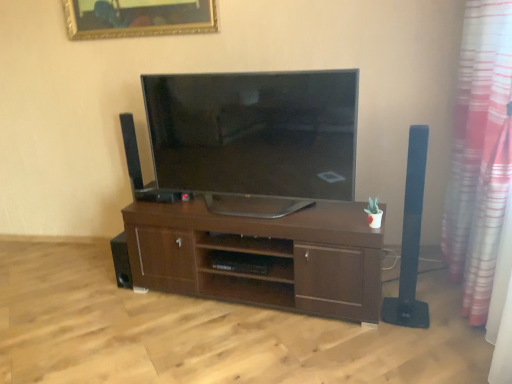
You are a GUI agent. You are given a task and a screenshot of the screen. Output one action in this format:
    pyautogui.click(x=<x>, y=<y>)
    Task: Click on the vacant space to the left of black matte speaker at lower left, acting as the 3th speaker starting from the right
    This screenshot has width=512, height=384.
    Given the screenshot: What is the action you would take?
    pyautogui.click(x=102, y=284)